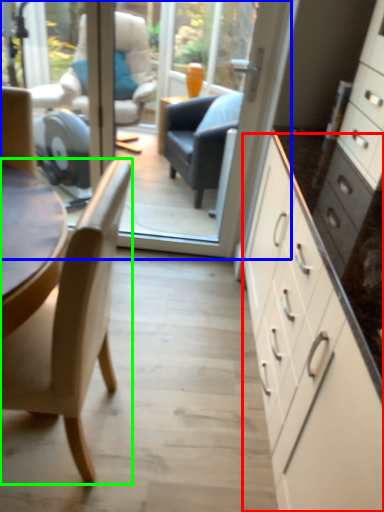
Question: Which object is the farthest from cabinetry (highlighted by a red box)? Choose among these: glass door (highlighted by a blue box) or chair (highlighted by a green box).

Choices:
 (A) glass door
 (B) chair

Answer: (A)